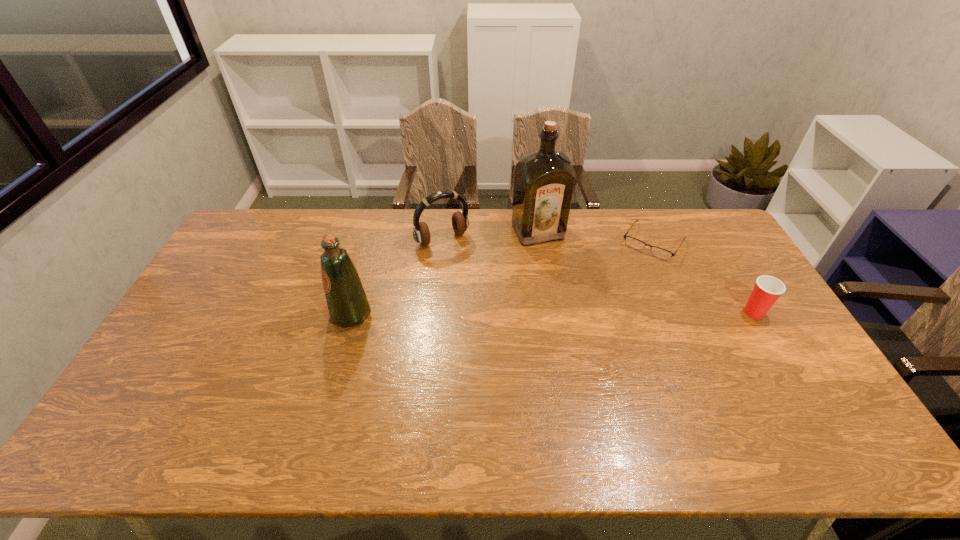
Where is `blank space located on the front-facing side of the second tallest object`? This screenshot has width=960, height=540. blank space located on the front-facing side of the second tallest object is located at coordinates (225, 315).

This screenshot has height=540, width=960. In order to click on free point located on the front-facing side of the second tallest object in this screenshot , I will do `click(271, 315)`.

You are a GUI agent. You are given a task and a screenshot of the screen. Output one action in this format:
    pyautogui.click(x=<x>, y=<y>)
    Task: Click on the free space located on the front-facing side of the second tallest object
    
    Given the screenshot: What is the action you would take?
    pyautogui.click(x=222, y=315)

Locate an element on the screen. vacant region located on the front of the rightmost object is located at coordinates (782, 361).

Find the location of `vacant position located on the front-facing side of the shortest object`. vacant position located on the front-facing side of the shortest object is located at coordinates pos(605,318).

I want to click on free space located on the front-facing side of the shortest object, so click(633, 274).

At what (x,y) coordinates should I click in order to perform the action: click on vacant space situated on the front-facing side of the shortest object. Please return your answer as a coordinate pair (x, y). This screenshot has height=540, width=960. Looking at the image, I should click on (618, 295).

I want to click on free region located 0.310m on the ear cup of the third shortest object, so click(x=494, y=309).

Image resolution: width=960 pixels, height=540 pixels. Identify the location of vacant area located 0.360m on the ear cup of the third shortest object. (503, 320).

Find the location of a particular element. free space located on the ear cup of the third shortest object is located at coordinates (482, 291).